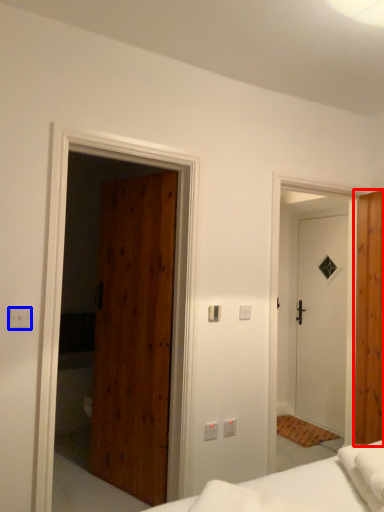
Question: Among these objects, which one is farthest to the camera, door (highlighted by a red box) or electric outlet (highlighted by a blue box)?

Choices:
 (A) door
 (B) electric outlet

Answer: (A)